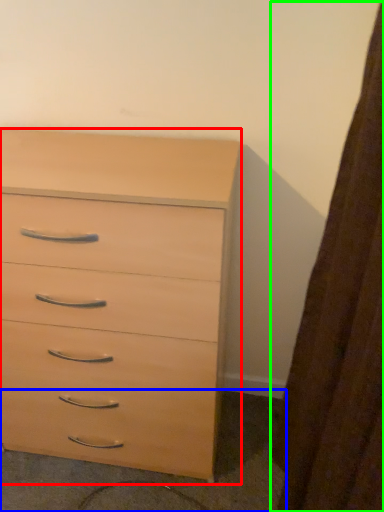
Question: Which object is positioned closest to chest of drawers (highlighted by a red box)? Select from concrete (highlighted by a blue box) and curtain (highlighted by a green box).

Choices:
 (A) concrete
 (B) curtain

Answer: (A)